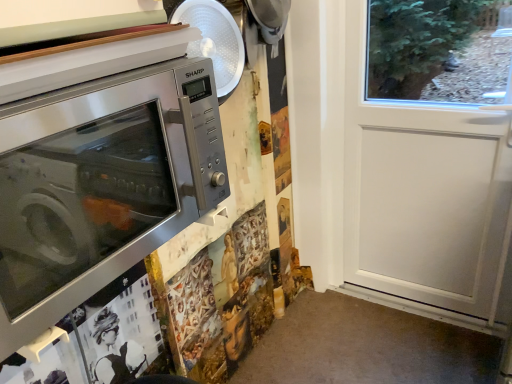
Identify the location of satin silver microwave at left. (100, 185).

What is the approximate height of satin silver microwave at left?

11.04 inches.

This screenshot has height=384, width=512. Describe the element at coordinates (100, 185) in the screenshot. I see `satin silver microwave at left` at that location.

Identify the location of satin silver microwave at left. (100, 185).